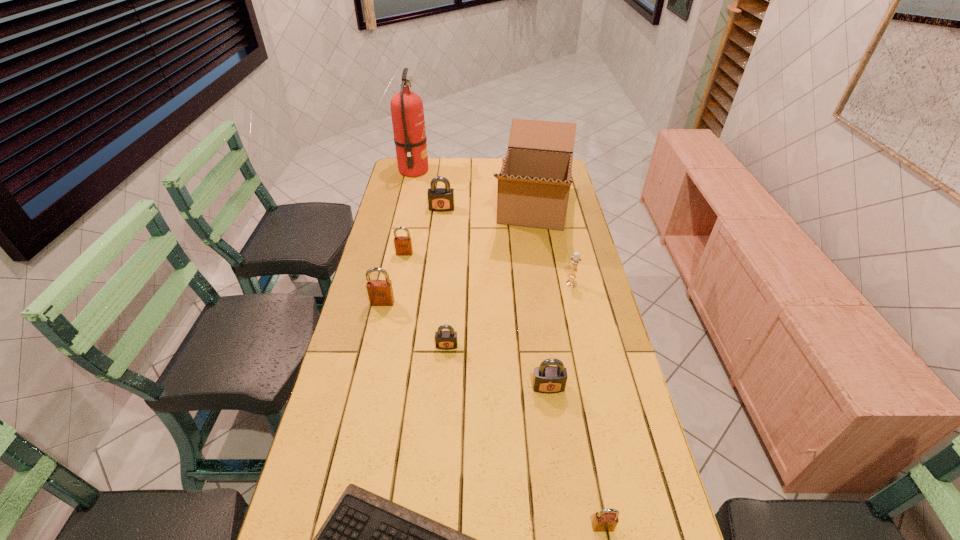
Where is `object present at the far left corner`? The image size is (960, 540). object present at the far left corner is located at coordinates (407, 112).

Identify the location of object present at the far right corner. The width and height of the screenshot is (960, 540). (534, 183).

The width and height of the screenshot is (960, 540). In the image, there is a desktop. What are the coordinates of `vacant space at the far edge` in the screenshot? It's located at (452, 165).

Identify the location of vacant space at the left edge of the desktop. This screenshot has height=540, width=960. (351, 361).

The height and width of the screenshot is (540, 960). What are the coordinates of `vacant region at the right edge` in the screenshot? It's located at (568, 220).

Locate an element on the screen. This screenshot has height=540, width=960. free space at the far left corner of the desktop is located at coordinates (425, 174).

Locate an element on the screen. The image size is (960, 540). vacant area that lies between the fifth farthest object and the smallest brown padlock is located at coordinates (588, 405).

Where is `free space between the farthest brown padlock and the box`? The width and height of the screenshot is (960, 540). free space between the farthest brown padlock and the box is located at coordinates point(468,231).

Identify the location of free space between the second smallest gray padlock and the smallest gray padlock. Image resolution: width=960 pixels, height=540 pixels. (497, 367).

Find the location of a particular element. This screenshot has width=960, height=540. empty space that is in between the biggest gray padlock and the second farthest gray padlock is located at coordinates (444, 277).